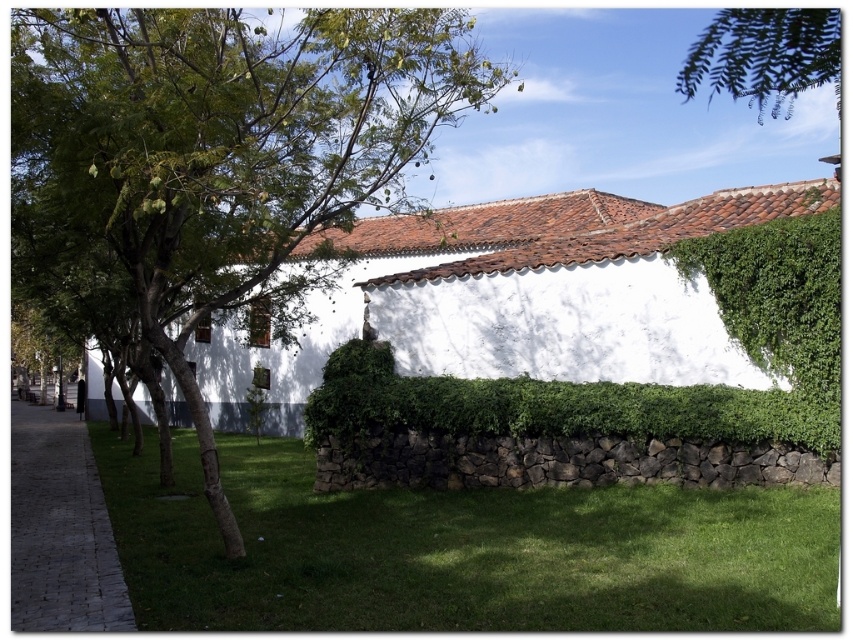
You are standing in front of the building and notice both the green leafy tree at center and the green leafy hedge at center. Which one is positioned higher relative to the other?

The green leafy tree at center is positioned higher than the green leafy hedge at center.

You are planning to plant a new flower bed in the garden. You have two options for locations near the green leafy hedge at center and the paved stone sidewalk at lower left. Which location would require less space due to the existing object size?

The green leafy hedge at center has a smaller size compared to the paved stone sidewalk at lower left, so planting near the green leafy hedge at center would require less space.

You are standing on the paved stone sidewalk at lower left and looking towards the green leafy branch at upper right. Can you see the entire branch, or is part of it hidden by something?

The green leafy branch at upper right is behind the paved stone sidewalk at lower left, so part of it is hidden from your view.